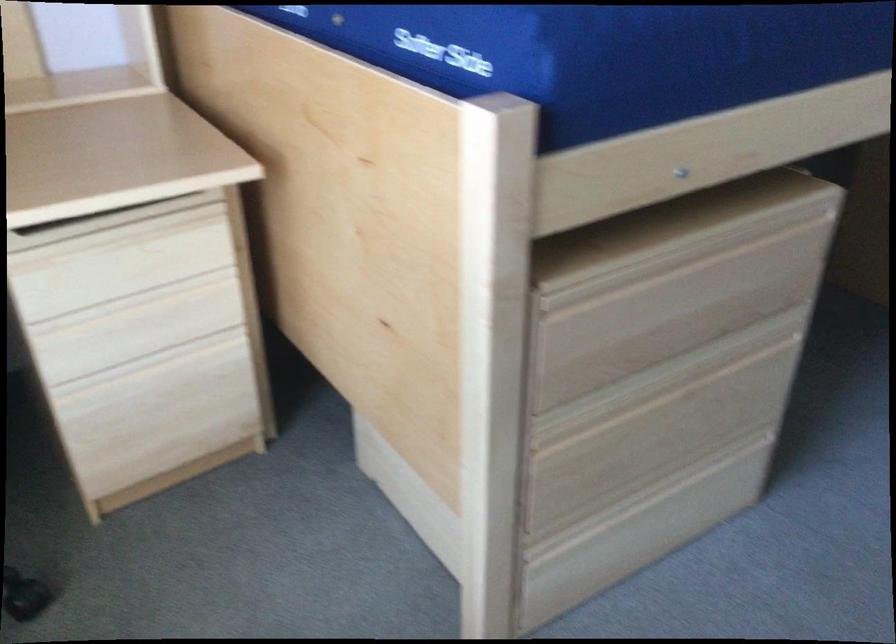
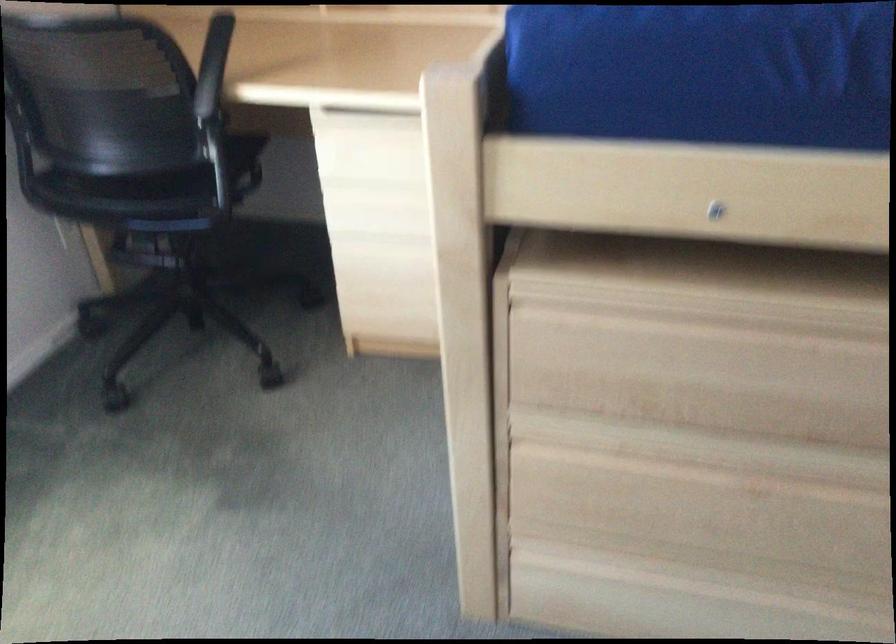
Locate, in the second image, the point that corresponds to point 655,270 in the first image.

(711, 321)